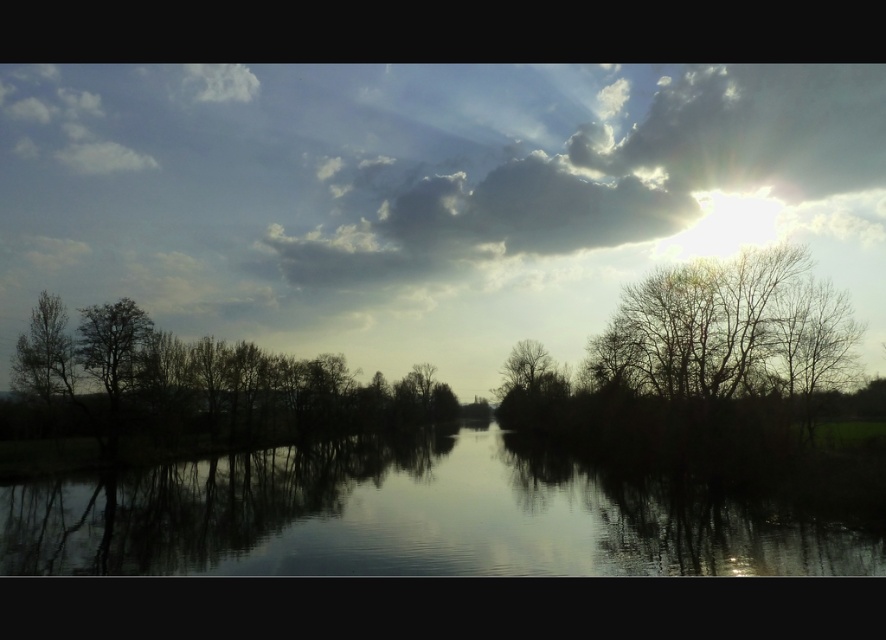
Question: Which point is closer to the camera taking this photo?

Choices:
 (A) (459, 474)
 (B) (127, 358)
 (C) (48, 301)

Answer: (A)

Question: From the image, what is the correct spatial relationship of cloudy sky at upper center in relation to silhouette leafless tree at left?

Choices:
 (A) right
 (B) left

Answer: (A)

Question: Which of these objects is positioned closest to the green matte tree at left?

Choices:
 (A) silhouette leafless tree at left
 (B) bare branches at center
 (C) silvery reflective water at center

Answer: (A)

Question: Does silvery reflective water at center appear under cloudy sky at upper center?

Choices:
 (A) yes
 (B) no

Answer: (A)

Question: Is cloudy sky at upper center further to camera compared to dark green leafy tree at left?

Choices:
 (A) no
 (B) yes

Answer: (B)

Question: Which point is farther to the camera?

Choices:
 (A) bare branches at center
 (B) silvery reflective water at center

Answer: (A)